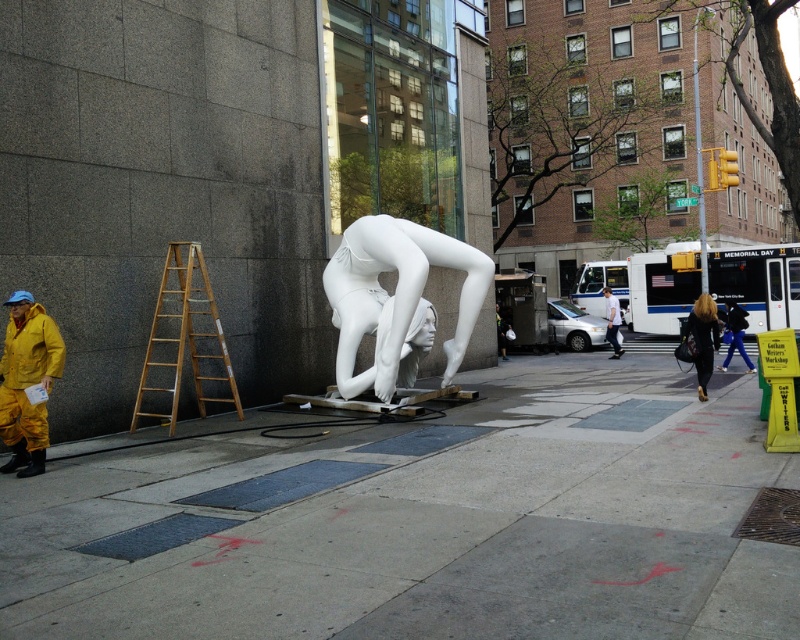
You are a delivery person carrying a heavy box and need to pass by the wooden ladder at left and the black leather jacket at center. Which object is closer to you so you can navigate around it first?

The wooden ladder at left is closer to the viewer than the black leather jacket at center, so you should navigate around the wooden ladder at left first.